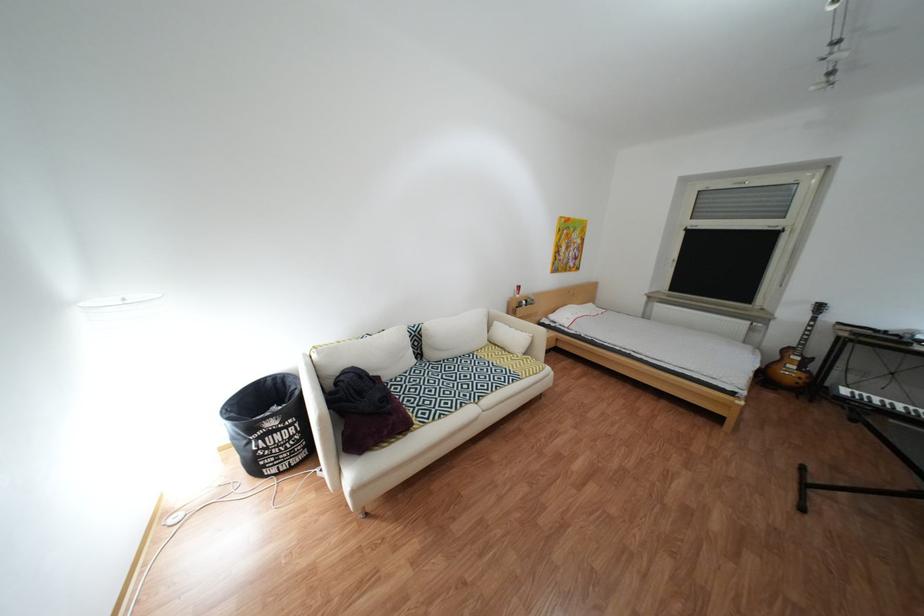
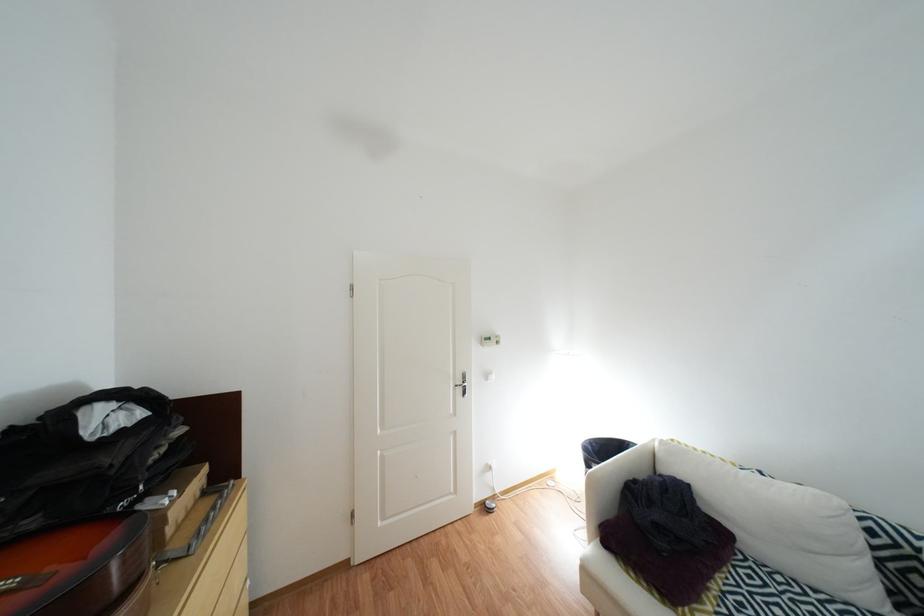
Question: The camera is either moving clockwise (left) or counter-clockwise (right) around the object. The first image is from the beginning of the video and the second image is from the end. Is the camera moving left or right when shooting the video?

Choices:
 (A) Left
 (B) Right

Answer: (B)